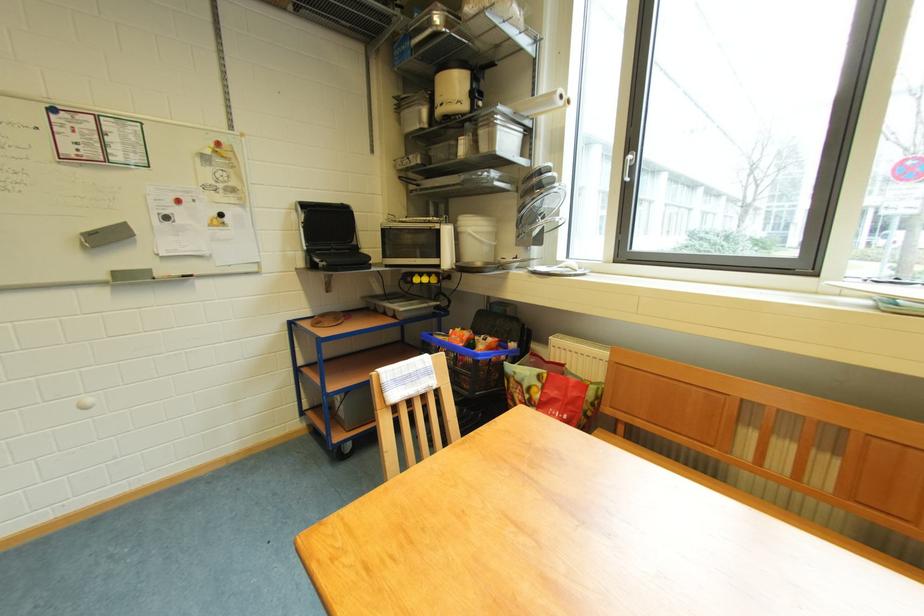
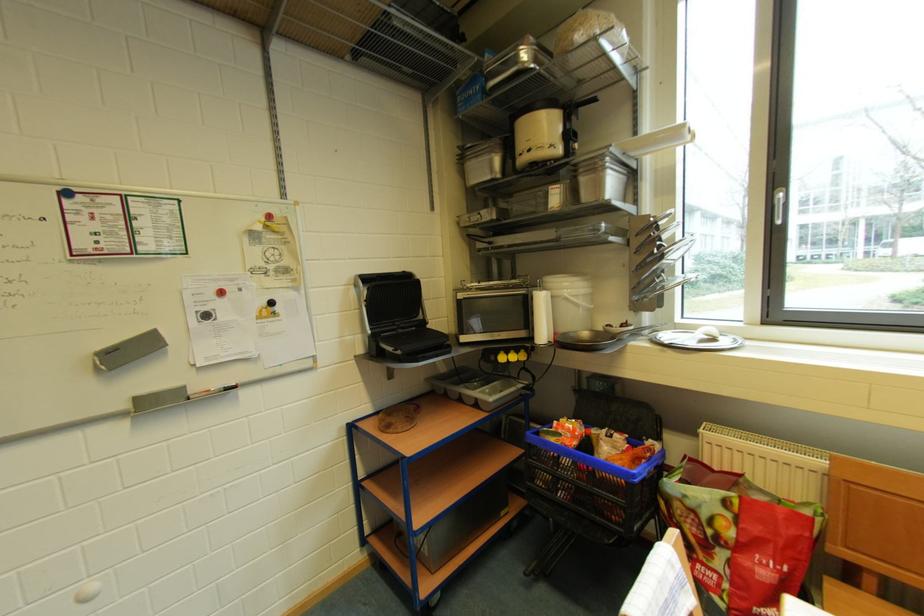
Question: How did the camera likely rotate?

Choices:
 (A) Left
 (B) Right
 (C) Up
 (D) Down

Answer: (C)